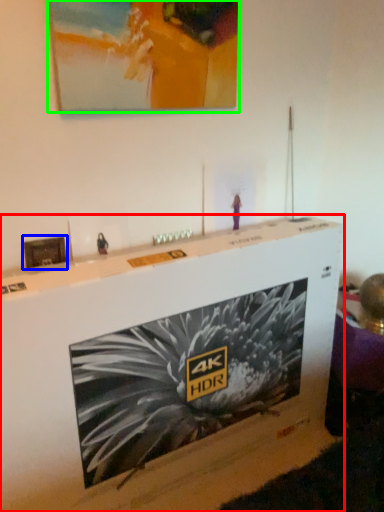
Question: Which object is positioned closest to furniture (highlighted by a red box)? Select from picture frame (highlighted by a blue box) and picture frame (highlighted by a green box).

Choices:
 (A) picture frame
 (B) picture frame

Answer: (A)